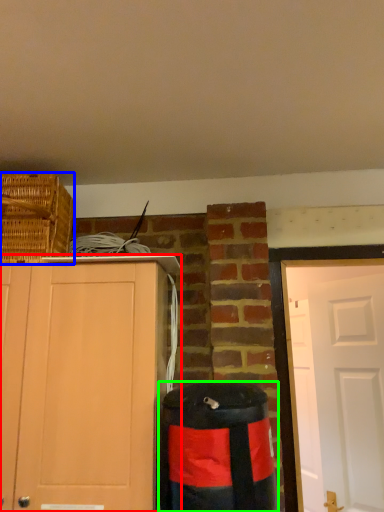
Question: Considering the real-world distances, which object is farthest from cabinetry (highlighted by a red box)? basket (highlighted by a blue box) or waste container (highlighted by a green box)?

Choices:
 (A) basket
 (B) waste container

Answer: (A)